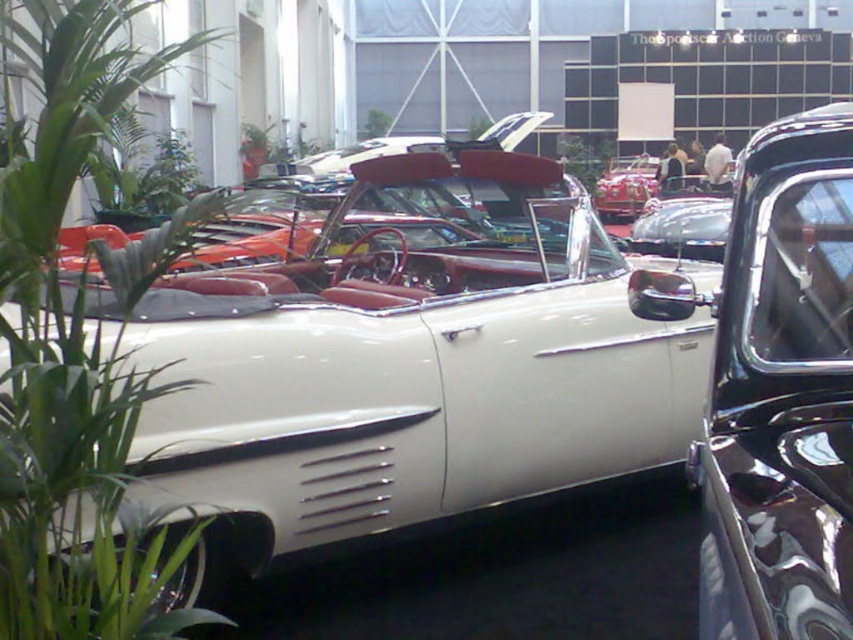
Question: Can you confirm if green leafy plant at left is positioned to the right of glossy black car at center?

Choices:
 (A) yes
 (B) no

Answer: (B)

Question: Where is green leafy plant at left located in relation to glossy black car at center in the image?

Choices:
 (A) below
 (B) above

Answer: (B)

Question: Among these points, which one is farthest from the camera?

Choices:
 (A) (804, 538)
 (B) (38, 422)

Answer: (B)

Question: Does green leafy plant at left have a smaller size compared to glossy black car at center?

Choices:
 (A) yes
 (B) no

Answer: (B)

Question: Which point is farther to the camera?

Choices:
 (A) glossy black car at center
 (B) green leafy plant at left

Answer: (B)